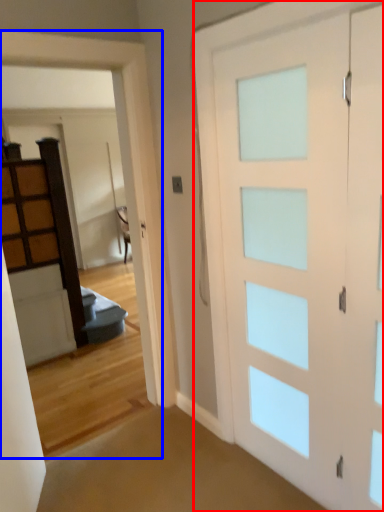
Question: Which point is closer to the camera, barn door (highlighted by a red box) or garage door (highlighted by a blue box)?

Choices:
 (A) barn door
 (B) garage door

Answer: (A)